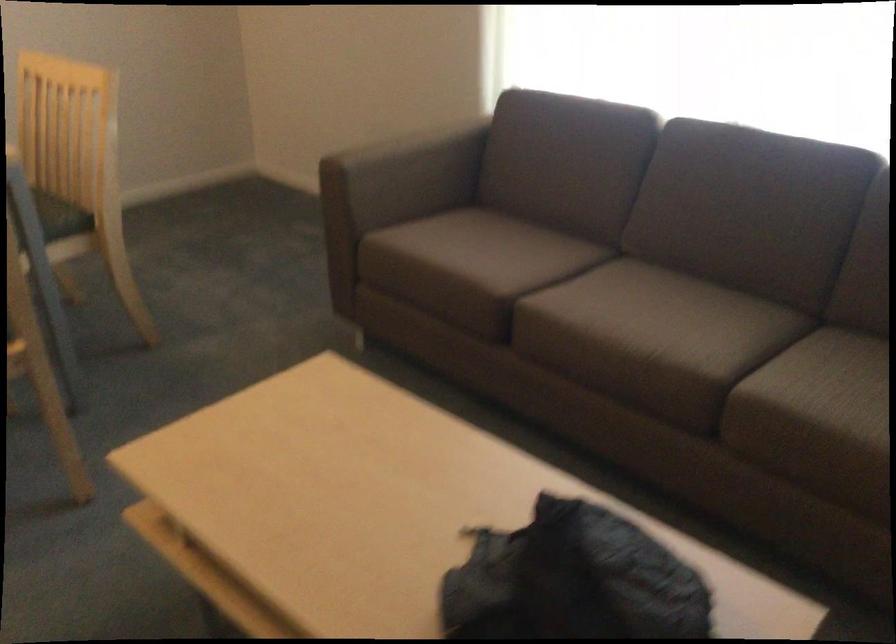
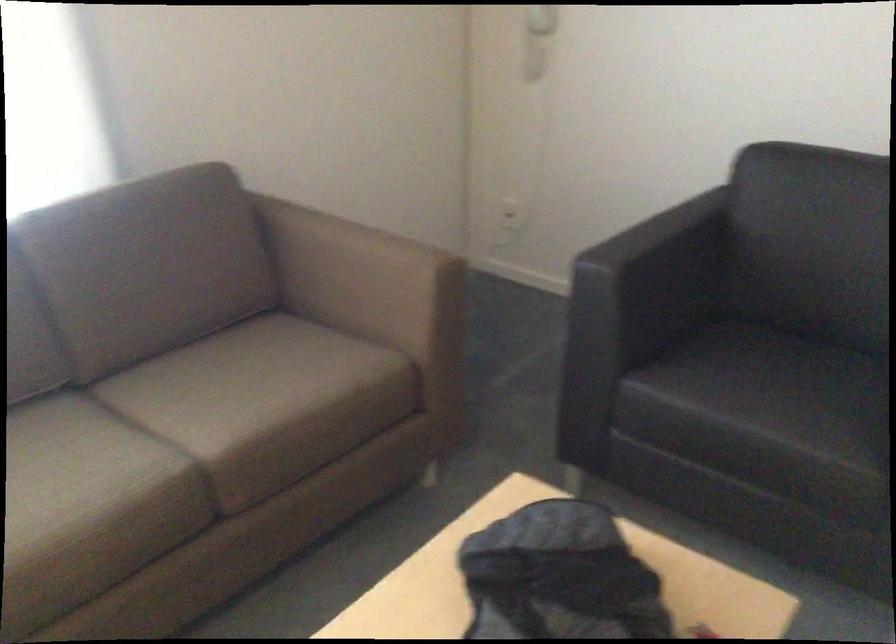
Where in the second image is the point corresponding to pixel 533 547 from the first image?

(558, 576)